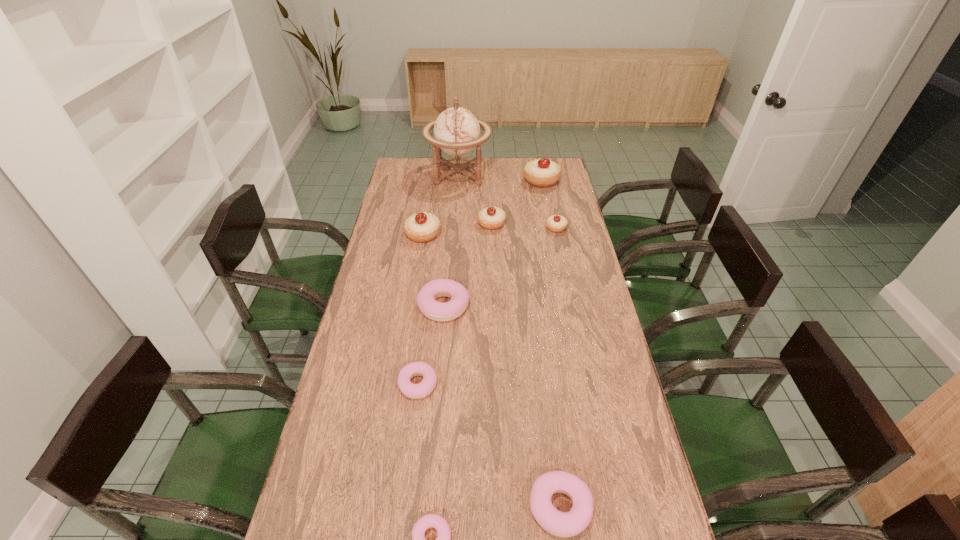
You are a GUI agent. You are given a task and a screenshot of the screen. Output one action in this format:
    pyautogui.click(x=<x>, y=<y>)
    Task: Click on the vacant area between the sixth shortest pastry and the globe
    This screenshot has height=540, width=960.
    Given the screenshot: What is the action you would take?
    pyautogui.click(x=475, y=199)

Locate an element on the screen. Image resolution: width=960 pixels, height=540 pixels. empty location between the eighth tallest object and the smallest beige pastry is located at coordinates (487, 306).

At what (x,y) coordinates should I click in order to perform the action: click on free space between the tallest object and the smallest beige pastry. Please return your answer as a coordinate pair (x, y). The height and width of the screenshot is (540, 960). Looking at the image, I should click on (508, 201).

Locate which object ranks fifth in proximity to the sixth tallest pastry. Please provide its 2D coordinates. Your answer should be formatted as a tuple, i.e. [(x, y)], where the tuple contains the x and y coordinates of a point satisfying the conditions above.

[(555, 223)]

The image size is (960, 540). Identify the location of the sixth closest object relative to the third nearest pastry. (555, 223).

Select which pastry is the second closest to the smallest beige pastry. Please provide its 2D coordinates. Your answer should be formatted as a tuple, i.e. [(x, y)], where the tuple contains the x and y coordinates of a point satisfying the conditions above.

[(543, 172)]

The width and height of the screenshot is (960, 540). In order to click on the sixth closest pastry to the smallest beige pastry in this screenshot , I will do `click(562, 524)`.

Find the location of a particular element. The image size is (960, 540). beige pastry that stands as the third closest to the second smallest pink pastry is located at coordinates (555, 223).

You are a GUI agent. You are given a task and a screenshot of the screen. Output one action in this format:
    pyautogui.click(x=<x>, y=<y>)
    Task: Click on the beige pastry that is the second closest to the biggest beige pastry
    
    Given the screenshot: What is the action you would take?
    pyautogui.click(x=555, y=223)

Find the location of a particular element. The image size is (960, 540). the closest pink pastry relative to the second shortest pastry is located at coordinates (432, 309).